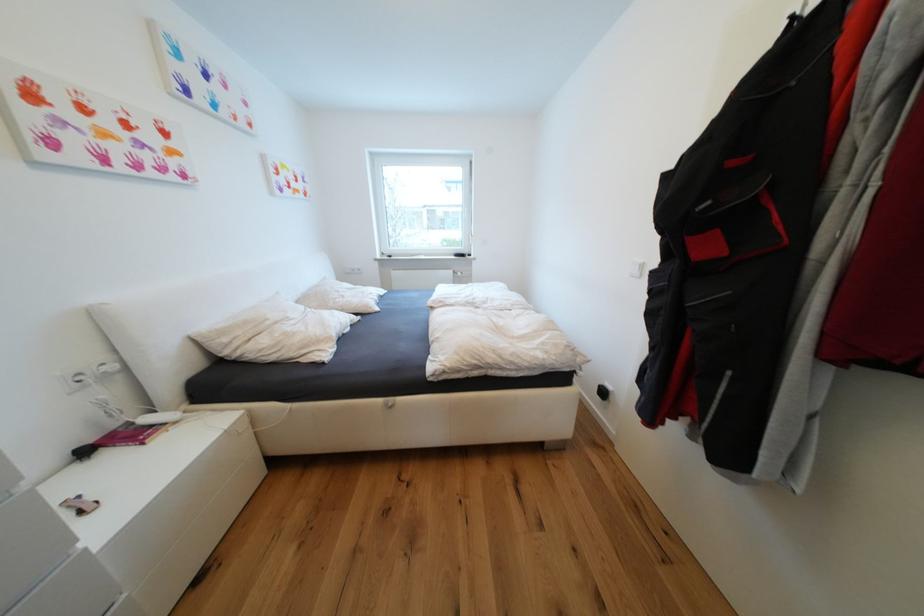
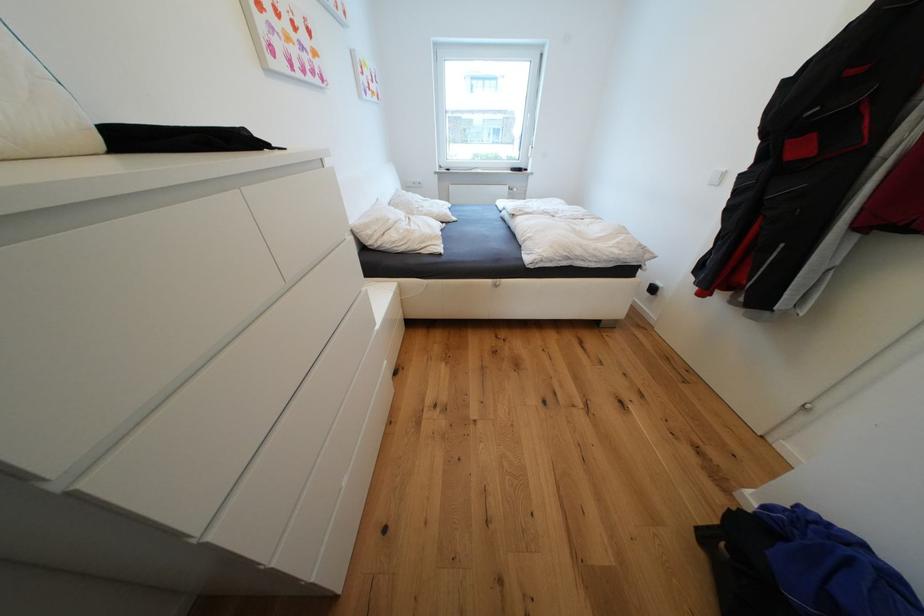
Locate, in the second image, the point that corresponds to point 233,341 in the first image.

(377, 233)